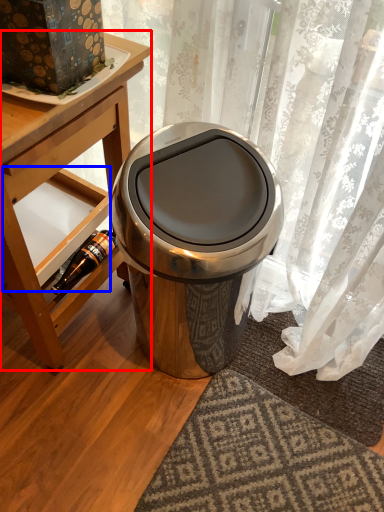
Question: Which point is closer to the camera, table (highlighted by a red box) or shelf (highlighted by a blue box)?

Choices:
 (A) table
 (B) shelf

Answer: (A)